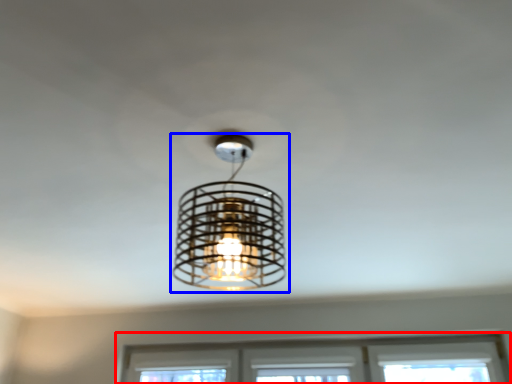
Question: Among these objects, which one is farthest to the camera, window (highlighted by a red box) or lamp (highlighted by a blue box)?

Choices:
 (A) window
 (B) lamp

Answer: (A)